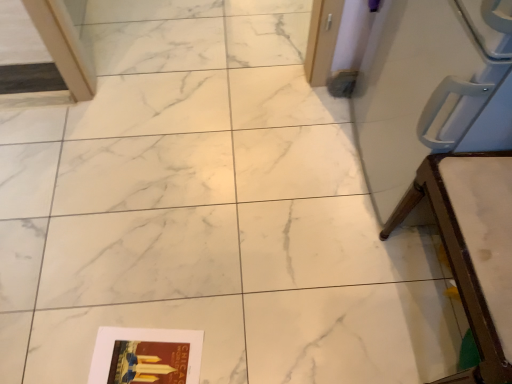
Question: From the image's perspective, is white plastic chair at right positioned above or below matte paper magazine at lower left?

Choices:
 (A) above
 (B) below

Answer: (A)

Question: In terms of width, does white plastic chair at right look wider or thinner when compared to matte paper magazine at lower left?

Choices:
 (A) thin
 (B) wide

Answer: (B)

Question: In terms of height, does white plastic chair at right look taller or shorter compared to matte paper magazine at lower left?

Choices:
 (A) short
 (B) tall

Answer: (B)

Question: Is matte paper magazine at lower left situated inside white plastic chair at right or outside?

Choices:
 (A) outside
 (B) inside

Answer: (A)

Question: Is matte paper magazine at lower left wider or thinner than white plastic chair at right?

Choices:
 (A) thin
 (B) wide

Answer: (A)

Question: In terms of height, does matte paper magazine at lower left look taller or shorter compared to white plastic chair at right?

Choices:
 (A) short
 (B) tall

Answer: (A)

Question: Does point (117, 364) appear closer or farther from the camera than point (386, 236)?

Choices:
 (A) farther
 (B) closer

Answer: (B)